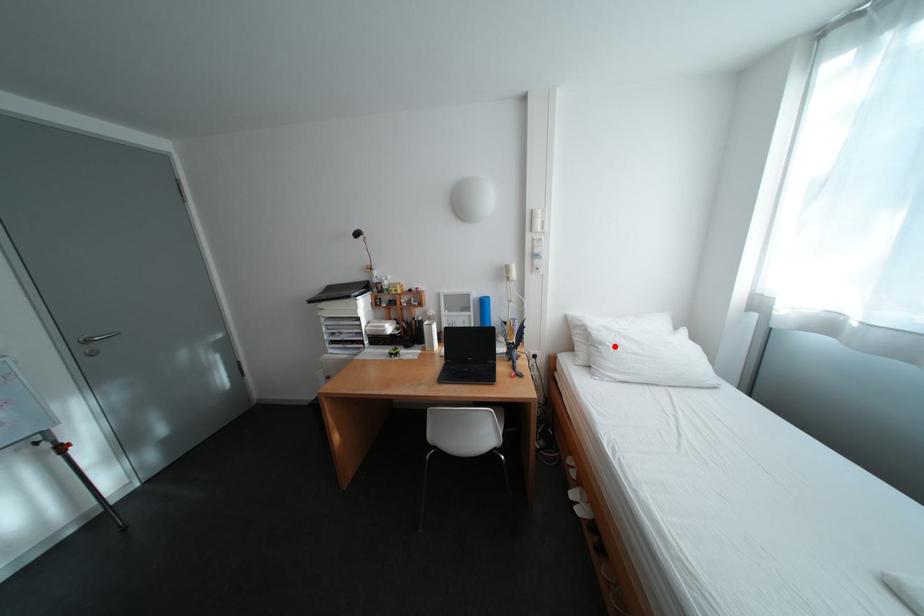
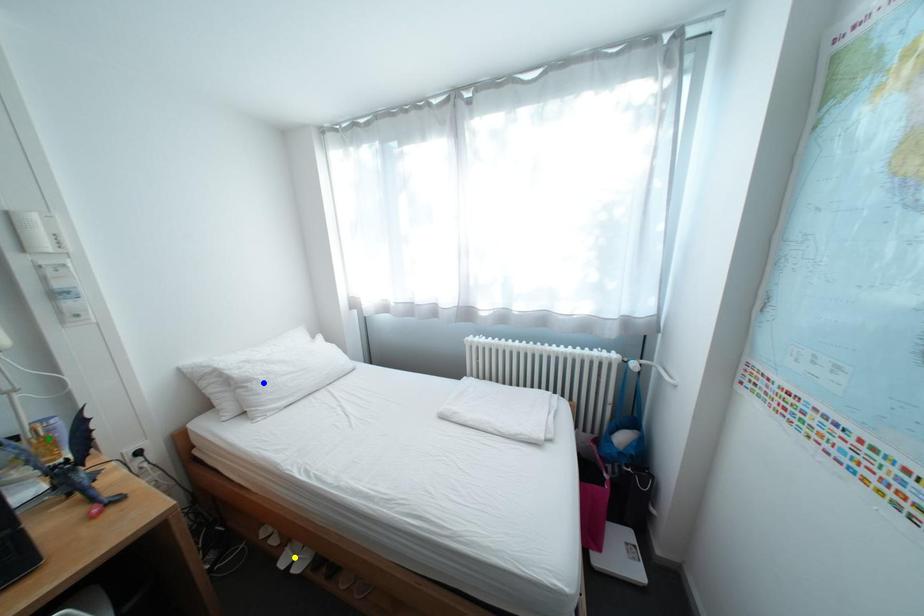
Question: I am providing you with two images of the same scene from different viewpoints. A red point is marked on the first image. You are given multiple points on the second image. Which spot in image 2 lines up with the point in image 1?

Choices:
 (A) blue point
 (B) green point
 (C) yellow point

Answer: (A)